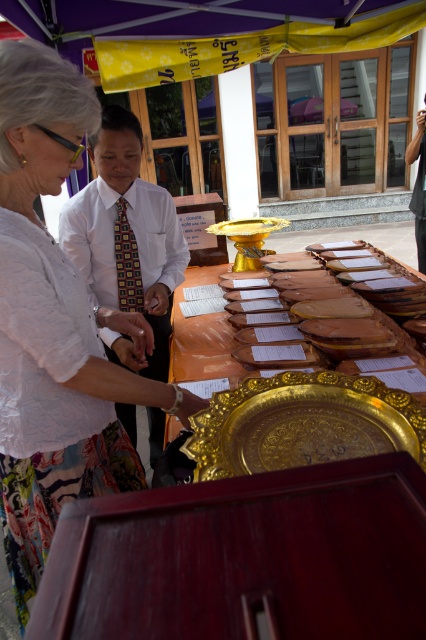
Question: Which object is positioned closest to the gold metallic tray at center?

Choices:
 (A) light brown suit at center
 (B) multicolored woven tie at center
 (C) white lace blouse at upper left
 (D) white shirt with tie at center

Answer: (D)

Question: Does white lace blouse at upper left appear over multicolored woven tie at center?

Choices:
 (A) no
 (B) yes

Answer: (A)

Question: Which object is the closest to the white shirt with tie at center?

Choices:
 (A) gold metallic tray at center
 (B) light brown suit at center
 (C) white lace blouse at upper left
 (D) multicolored woven tie at center

Answer: (D)

Question: Estimate the real-world distances between objects in this image. Which object is closer to the gold metallic tray at center?

Choices:
 (A) light brown suit at center
 (B) multicolored woven tie at center
 (C) white shirt with tie at center

Answer: (C)

Question: Does white lace blouse at upper left appear on the left side of white shirt with tie at center?

Choices:
 (A) no
 (B) yes

Answer: (A)

Question: Can you confirm if white lace blouse at upper left is thinner than gold metallic tray at center?

Choices:
 (A) no
 (B) yes

Answer: (B)